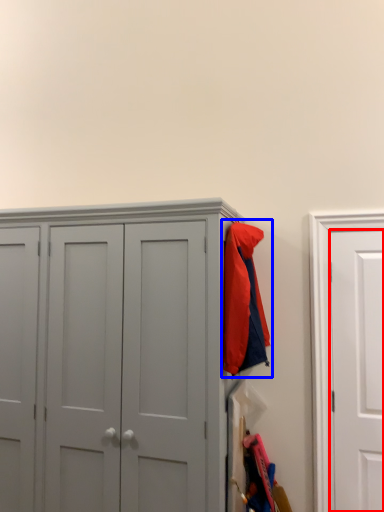
Question: Among these objects, which one is nearest to the camera, door (highlighted by a red box) or jacket (highlighted by a blue box)?

Choices:
 (A) door
 (B) jacket

Answer: (B)